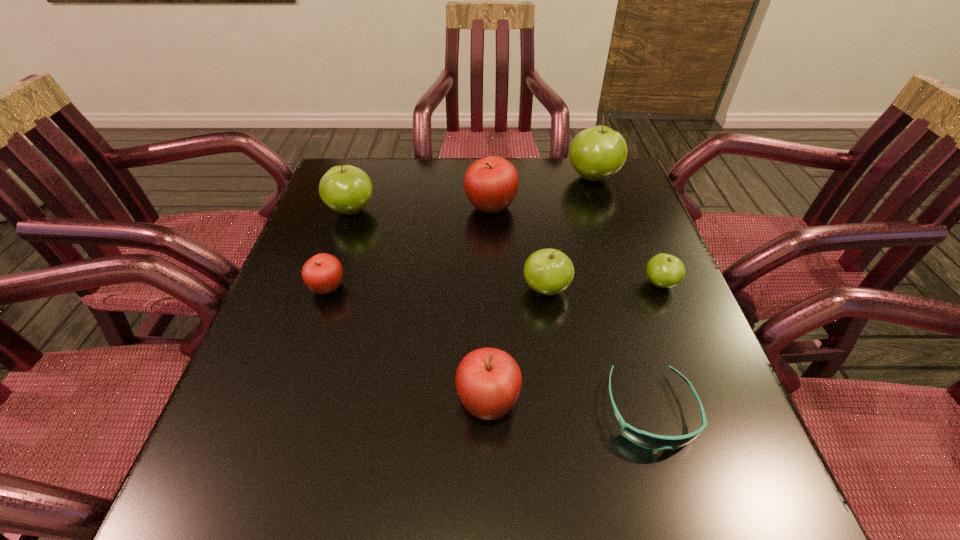
Identify the location of the tallest apple. This screenshot has width=960, height=540. (596, 153).

The image size is (960, 540). I want to click on the tallest object, so click(x=596, y=153).

At what (x,y) coordinates should I click in order to perform the action: click on the biggest red apple. Please return your answer as a coordinate pair (x, y). Looking at the image, I should click on (491, 183).

Where is `the leftmost green apple`? The height and width of the screenshot is (540, 960). the leftmost green apple is located at coordinates (346, 189).

Where is `the second farthest green apple`? The width and height of the screenshot is (960, 540). the second farthest green apple is located at coordinates (346, 189).

I want to click on the third green apple from right to left, so click(x=547, y=271).

Locate an element on the screen. The image size is (960, 540). the second smallest red apple is located at coordinates (488, 380).

Locate an element on the screen. This screenshot has height=540, width=960. the nearest apple is located at coordinates click(488, 380).

This screenshot has height=540, width=960. What are the coordinates of `the leftmost red apple` in the screenshot? It's located at (323, 273).

At what (x,y) coordinates should I click in order to perform the action: click on the second nearest red apple. Please return your answer as a coordinate pair (x, y). The width and height of the screenshot is (960, 540). Looking at the image, I should click on (323, 273).